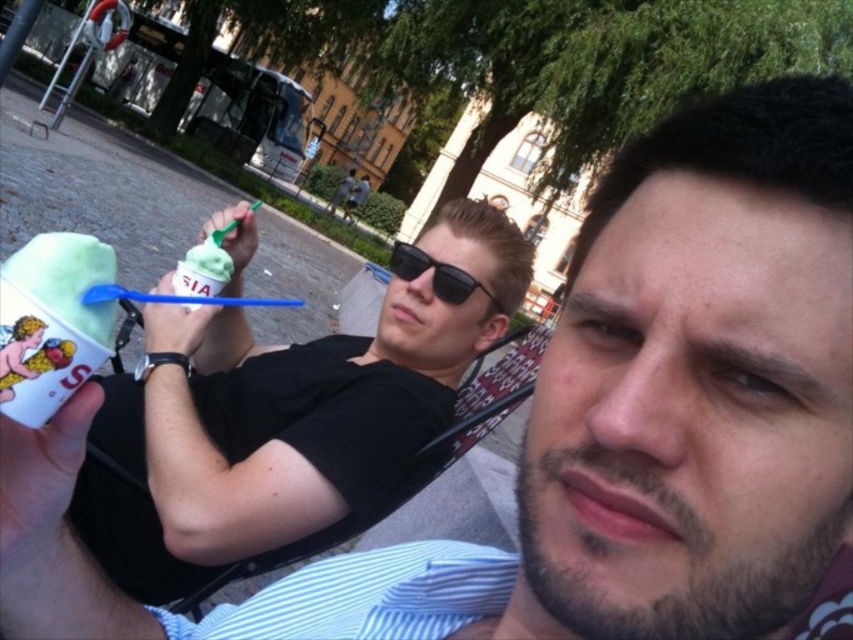
You are a photographer trying to capture a closeup of the green matte ice cream at center and the black plastic sunglasses at center. Which object should you zoom in on to ensure it fills the frame more, considering their sizes?

The green matte ice cream at center is much taller than the black plastic sunglasses at center, so you should zoom in on the green matte ice cream at center to ensure it fills the frame more.

You are standing at the point with coordinates point (258, 529) and want to walk towards the point with coordinates point (396, 276). Which direction should you move to reach there?

To reach point (396, 276) from point (258, 529), you should move backward since point (396, 276) is behind point (258, 529).